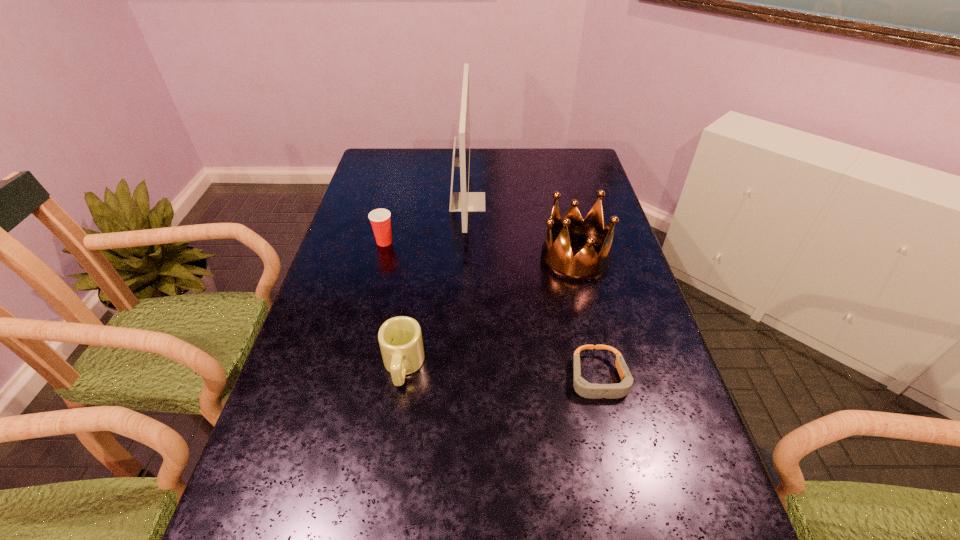
Where is `vacant area that lies between the second object from left to right and the leftmost object`? vacant area that lies between the second object from left to right and the leftmost object is located at coordinates (394, 304).

Where is `empty location between the goggles and the mug`? empty location between the goggles and the mug is located at coordinates (501, 373).

Where is `free spot between the second object from left to right and the goggles`? The image size is (960, 540). free spot between the second object from left to right and the goggles is located at coordinates (501, 373).

Locate an element on the screen. unoccupied area between the shortest object and the fourth shortest object is located at coordinates (587, 319).

This screenshot has height=540, width=960. What are the coordinates of `empty space that is in between the shortest object and the Dixie cup` in the screenshot? It's located at (492, 310).

You are a GUI agent. You are given a task and a screenshot of the screen. Output one action in this format:
    pyautogui.click(x=<x>, y=<y>)
    Task: Click on the free spot between the goggles and the fourth shortest object
    This screenshot has height=540, width=960.
    Given the screenshot: What is the action you would take?
    pyautogui.click(x=587, y=319)

Identify the location of vacant area between the goggles and the second object from left to right. (501, 373).

Locate an element on the screen. The image size is (960, 540). free space between the goggles and the mug is located at coordinates (501, 373).

Select which object appears as the second closest to the leftmost object. Please provide its 2D coordinates. Your answer should be formatted as a tuple, i.e. [(x, y)], where the tuple contains the x and y coordinates of a point satisfying the conditions above.

[(400, 339)]

Identify the location of the second closest object to the mug. (464, 201).